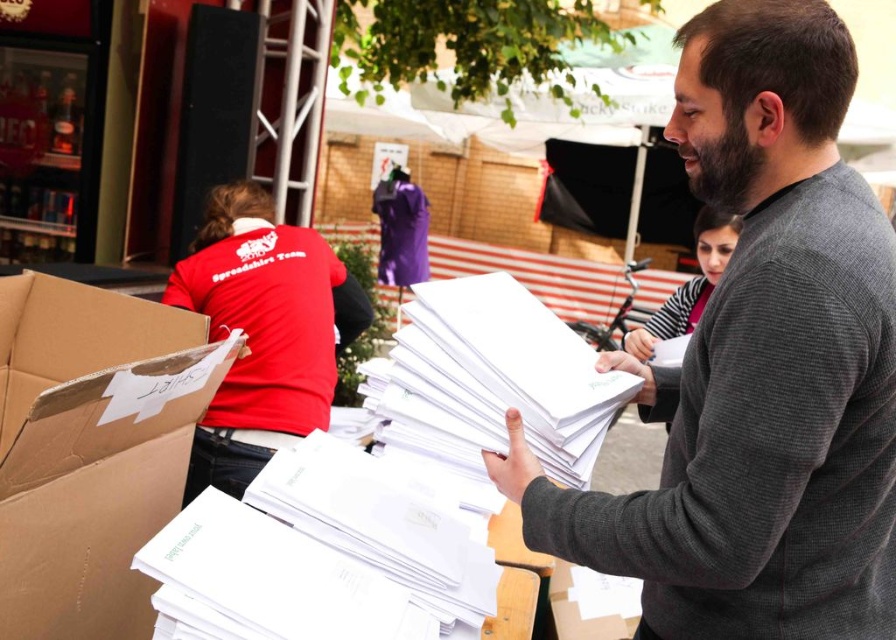
You are a tailor measuring the distance between two items in the image. You need to determine if a 25 cm ruler can reach from the gray wool sweater at center to the dark brown thick beard at center. Can it?

The distance between the gray wool sweater at center and the dark brown thick beard at center is 23.99 centimeters, which is less than 25 cm. Therefore, the ruler can reach between them.

You are standing in the scene and want to place a 24 inch wide package into the brown cardboard box at lower left. Can the package fit inside the box?

The distance between the brown cardboard box at lower left and the viewer is 33.05 inches, but this measurement does not indicate the box size. Without knowing the box dimensions, it is impossible to determine if the package will fit.

You are a fashion designer observing a man in an outdoor setting. You notice the gray wool sweater at center and the dark brown thick beard at center. Which object would you say is bigger in size?

The gray wool sweater at center is larger in size than the dark brown thick beard at center.